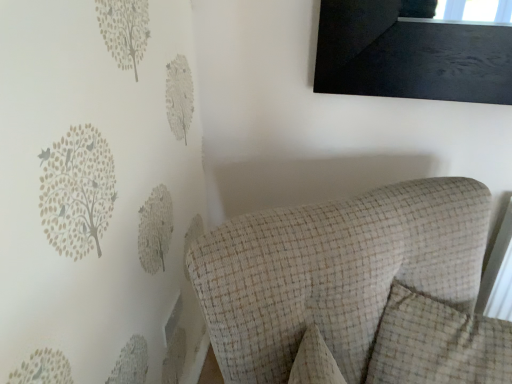
Question: Is beige checkered pillow at center bigger than textured beige armchair at center?

Choices:
 (A) yes
 (B) no

Answer: (B)

Question: Does beige checkered pillow at center have a greater width compared to textured beige armchair at center?

Choices:
 (A) no
 (B) yes

Answer: (A)

Question: Is beige checkered pillow at center not near textured beige armchair at center?

Choices:
 (A) yes
 (B) no

Answer: (B)

Question: Is beige checkered pillow at center positioned behind textured beige armchair at center?

Choices:
 (A) no
 (B) yes

Answer: (B)

Question: Is beige checkered pillow at center not inside textured beige armchair at center?

Choices:
 (A) yes
 (B) no

Answer: (B)

Question: From the image's perspective, is beige checkered pillow at center located beneath textured beige armchair at center?

Choices:
 (A) yes
 (B) no

Answer: (B)

Question: From a real-world perspective, does textured beige armchair at center sit lower than beige checkered pillow at center?

Choices:
 (A) yes
 (B) no

Answer: (A)

Question: From the image's perspective, is textured beige armchair at center above beige checkered pillow at center?

Choices:
 (A) yes
 (B) no

Answer: (B)

Question: Considering the relative sizes of textured beige armchair at center and beige checkered pillow at center in the image provided, is textured beige armchair at center wider than beige checkered pillow at center?

Choices:
 (A) yes
 (B) no

Answer: (A)

Question: Would you say beige checkered pillow at center is part of textured beige armchair at center's contents?

Choices:
 (A) no
 (B) yes

Answer: (B)

Question: From the image's perspective, does textured beige armchair at center appear lower than beige checkered pillow at center?

Choices:
 (A) no
 (B) yes

Answer: (B)

Question: Does textured beige armchair at center have a lesser width compared to beige checkered pillow at center?

Choices:
 (A) yes
 (B) no

Answer: (B)

Question: Considering the positions of textured beige armchair at center and beige checkered pillow at center in the image, is textured beige armchair at center bigger or smaller than beige checkered pillow at center?

Choices:
 (A) big
 (B) small

Answer: (A)